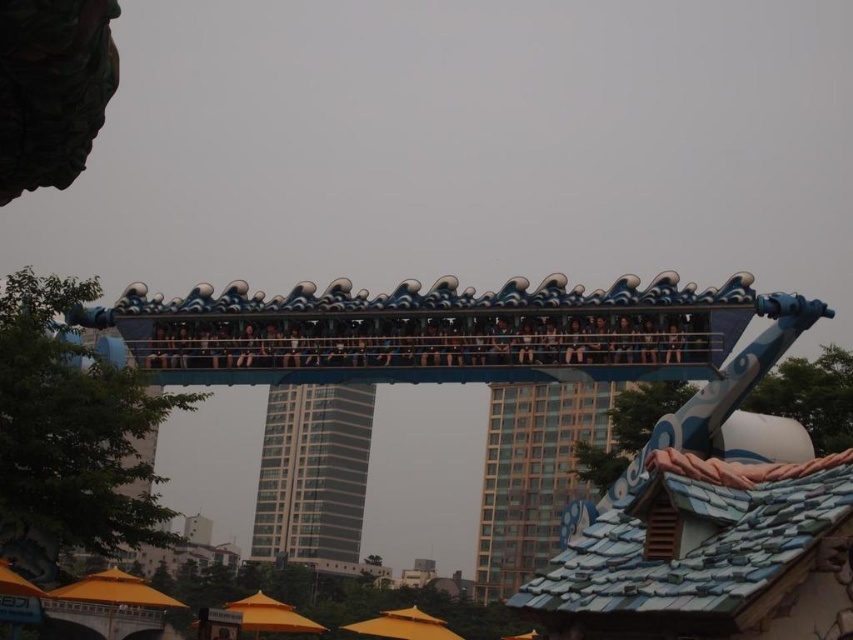
Does blue glossy roller coaster at center appear over blue fabric seats at center?

No, blue glossy roller coaster at center is not above blue fabric seats at center.

Which is behind, point (453, 356) or point (451, 356)?

Point (451, 356)

Where is `blue glossy roller coaster at center`? The image size is (853, 640). blue glossy roller coaster at center is located at coordinates (711, 520).